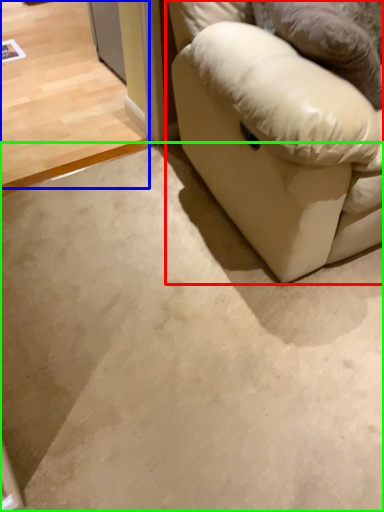
Question: Based on their relative distances, which object is farther from studio couch (highlighted by a red box)? Choose from concrete (highlighted by a blue box) and concrete (highlighted by a green box).

Choices:
 (A) concrete
 (B) concrete

Answer: (A)